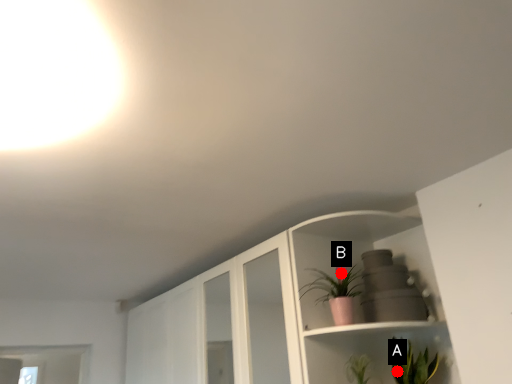
Question: Two points are circled on the image, labeled by A and B beside each circle. Which point is farther from the camera taking this photo?

Choices:
 (A) A is further
 (B) B is further

Answer: (A)